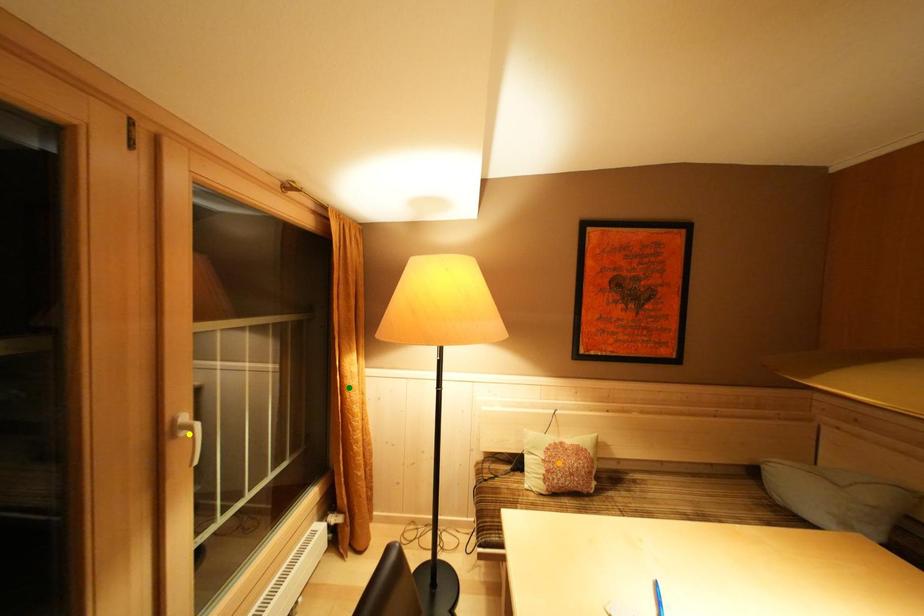
Order these from nearest to farthest:
1. orange point
2. yellow point
3. green point

yellow point < orange point < green point